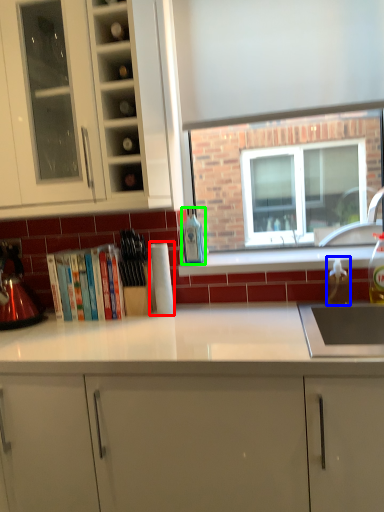
Question: Estimate the real-world distances between objects in this image. Which object is farther from paper towel (highlighted by a red box), bottle (highlighted by a blue box) or bottle (highlighted by a green box)?

Choices:
 (A) bottle
 (B) bottle

Answer: (A)